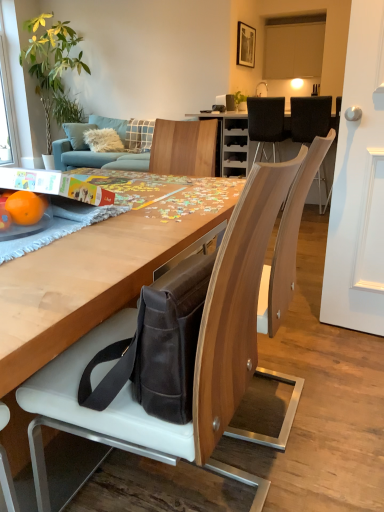
What do you see at coordinates (52, 68) in the screenshot? This screenshot has height=512, width=384. I see `green leafy plant at upper left` at bounding box center [52, 68].

What do you see at coordinates (6, 115) in the screenshot?
I see `transparent glass window screen at upper left` at bounding box center [6, 115].

The height and width of the screenshot is (512, 384). What do you see at coordinates (266, 122) in the screenshot?
I see `black leather chair at upper center, acting as the third chair starting from the front` at bounding box center [266, 122].

Identify the location of green leafy plant at upper left. This screenshot has height=512, width=384. (52, 68).

Is transparent glass window screen at upper left looking in the opposite direction of green leafy plant at upper left?

No, green leafy plant at upper left is not at the back of transparent glass window screen at upper left.

At what (x,y) coordinates should I click in order to perform the action: click on houseplant in front of the transparent glass window screen at upper left. Please return your answer as a coordinate pair (x, y). Looking at the image, I should click on (52, 68).

Consider the image. Is transparent glass window screen at upper left to the left of green leafy plant at upper left from the viewer's perspective?

Indeed, transparent glass window screen at upper left is positioned on the left side of green leafy plant at upper left.

From the image's perspective, between transparent glass window screen at upper left and green leafy plant at upper left, which one is located above?

green leafy plant at upper left.

From a real-world perspective, which object stands above the other?

In real-world perspective, orangesmoothfruit at left is above.

Between orangesmoothfruit at left and leather bag at lower center, marked as the 3th chair in a back-to-front arrangement, which one has larger size?

With larger size is leather bag at lower center, marked as the 3th chair in a back-to-front arrangement.

How different are the orientations of orangesmoothfruit at left and leather bag at lower center, marked as the 3th chair in a back-to-front arrangement, in degrees?

The angular difference between orangesmoothfruit at left and leather bag at lower center, marked as the 3th chair in a back-to-front arrangement, is 87.5 degrees.

Based on the photo, which point is more distant from viewer, (28, 201) or (271, 169)?

Positioned behind is point (28, 201).

Can you tell me how much leather bag at lower center, the first chair positioned from the front, and dark brown leather messenger bag at center differ in facing direction?

0.0012 degrees separate the facing orientations of leather bag at lower center, the first chair positioned from the front, and dark brown leather messenger bag at center.

Does leather bag at lower center, marked as the 3th chair in a back-to-front arrangement, appear on the right side of dark brown leather messenger bag at center?

Incorrect, leather bag at lower center, marked as the 3th chair in a back-to-front arrangement, is not on the right side of dark brown leather messenger bag at center.

Does leather bag at lower center, marked as the 3th chair in a back-to-front arrangement, come in front of dark brown leather messenger bag at center?

Yes.

From the picture: Who is taller, leather bag at lower center, acting as the third chair starting from the right, or dark brown leather messenger bag at center?

leather bag at lower center, acting as the third chair starting from the right, is taller.

From the picture: Looking at the image, does black leather chair at upper center, which is the second chair in left-to-right order, seem bigger or smaller compared to orangesmoothfruit at left?

black leather chair at upper center, which is the second chair in left-to-right order, is bigger than orangesmoothfruit at left.

From the image's perspective, who appears lower, black leather chair at upper center, the first chair positioned from the back, or orangesmoothfruit at left?

orangesmoothfruit at left.

Is orangesmoothfruit at left completely or partially inside black leather chair at upper center, which is counted as the third chair, starting from the bottom?

That's incorrect, orangesmoothfruit at left is not inside black leather chair at upper center, which is counted as the third chair, starting from the bottom.

How different are the orientations of leather bag at lower center, acting as the third chair starting from the top, and orangesmoothfruit at left in degrees?

The angular difference between leather bag at lower center, acting as the third chair starting from the top, and orangesmoothfruit at left is 87.5 degrees.

From a real-world perspective, is leather bag at lower center, the first chair positioned from the front, physically located above or below orangesmoothfruit at left?

leather bag at lower center, the first chair positioned from the front, is situated lower than orangesmoothfruit at left in the real world.

Is leather bag at lower center, which ranks as the 1th chair in bottom-to-top order, thinner than orangesmoothfruit at left?

No.

Based on their sizes in the image, would you say leather bag at lower center, marked as the 3th chair in a back-to-front arrangement, is bigger or smaller than orangesmoothfruit at left?

Clearly, leather bag at lower center, marked as the 3th chair in a back-to-front arrangement, is larger in size than orangesmoothfruit at left.

Consider the image. From a real-world perspective, is leather bag at lower center, which ranks as the 1th chair in bottom-to-top order, over black leather chair at upper center, which is the second chair in left-to-right order?

No, from a real-world perspective, leather bag at lower center, which ranks as the 1th chair in bottom-to-top order, is not over black leather chair at upper center, which is the second chair in left-to-right order

Between leather bag at lower center, the first chair positioned from the front, and black leather chair at upper center, which appears as the 2th chair when viewed from the right, which one has more height?

With more height is leather bag at lower center, the first chair positioned from the front.

Considering the positions of objects leather bag at lower center, marked as the 3th chair in a back-to-front arrangement, and black leather chair at upper center, the first chair positioned from the back, in the image provided, who is in front, leather bag at lower center, marked as the 3th chair in a back-to-front arrangement, or black leather chair at upper center, the first chair positioned from the back,?

leather bag at lower center, marked as the 3th chair in a back-to-front arrangement, is closer to the camera.

From the image's perspective, who appears lower, leather bag at lower center, acting as the third chair starting from the top, or black leather chair at upper center, which is the second chair in left-to-right order?

leather bag at lower center, acting as the third chair starting from the top, is shown below in the image.

Is black leather chair at upper right, arranged as the second chair when ordered from the bottom, touching green leafy plant at upper left?

No, black leather chair at upper right, arranged as the second chair when ordered from the bottom, is not with green leafy plant at upper left.

Considering the relative sizes of black leather chair at upper right, which ranks as the first chair in right-to-left order, and green leafy plant at upper left in the image provided, is black leather chair at upper right, which ranks as the first chair in right-to-left order, taller than green leafy plant at upper left?

Incorrect, the height of black leather chair at upper right, which ranks as the first chair in right-to-left order, is not larger of that of green leafy plant at upper left.

Does black leather chair at upper right, arranged as the second chair when ordered from the bottom, appear on the left side of green leafy plant at upper left?

In fact, black leather chair at upper right, arranged as the second chair when ordered from the bottom, is to the right of green leafy plant at upper left.

The image size is (384, 512). What are the coordinates of `houseplant above the transparent glass window screen at upper left (from the image's perspective)` in the screenshot? It's located at (52, 68).

The image size is (384, 512). What are the coordinates of `the 1st chair counting from the right side of the orangesmoothfruit at left` in the screenshot? It's located at (195, 361).

Looking at the image, which one is located further to black leather chair at upper center, which is the second chair in left-to-right order, orangesmoothfruit at left or dark brown leather messenger bag at center?

dark brown leather messenger bag at center lies further to black leather chair at upper center, which is the second chair in left-to-right order, than the other object.

Which object lies nearer to the anchor point green leafy plant at upper left, leather bag at lower center, acting as the third chair starting from the top, or transparent glass window screen at upper left?

The object closer to green leafy plant at upper left is transparent glass window screen at upper left.

Which object lies nearer to the anchor point transparent glass window screen at upper left, green leafy plant at upper left or dark brown leather messenger bag at center?

Based on the image, green leafy plant at upper left appears to be nearer to transparent glass window screen at upper left.

From the image, which object appears to be farther from dark brown leather messenger bag at center, black leather chair at upper right, marked as the 2th chair in a top-to-bottom arrangement, or orangesmoothfruit at left?

The object further to dark brown leather messenger bag at center is black leather chair at upper right, marked as the 2th chair in a top-to-bottom arrangement.

When comparing their distances from dark brown leather messenger bag at center, does transparent glass window screen at upper left or black leather chair at upper center, the first chair positioned from the back, seem further?

transparent glass window screen at upper left is positioned further to the anchor dark brown leather messenger bag at center.

Considering their positions, is black leather chair at upper right, arranged as the second chair when ordered from the bottom, positioned closer to transparent glass window screen at upper left than black leather chair at upper center, the first chair positioned from the back?

black leather chair at upper center, the first chair positioned from the back, is positioned closer to the anchor transparent glass window screen at upper left.

Estimate the real-world distances between objects in this image. Which object is further from leather bag at lower center, the first chair positioned from the front, black leather chair at upper center, the first chair positioned from the back, or green leafy plant at upper left?

The object further to leather bag at lower center, the first chair positioned from the front, is green leafy plant at upper left.

Considering their positions, is transparent glass window screen at upper left positioned closer to black leather chair at upper right, which ranks as the first chair in right-to-left order, than black leather chair at upper center, which is the second chair in left-to-right order?

Among the two, black leather chair at upper center, which is the second chair in left-to-right order, is located nearer to black leather chair at upper right, which ranks as the first chair in right-to-left order.

Identify the location of messenger bag located between leather bag at lower center, marked as the 3th chair in a back-to-front arrangement, and black leather chair at upper right, marked as the 2th chair in a top-to-bottom arrangement, in the depth direction. This screenshot has width=384, height=512. (158, 346).

The image size is (384, 512). Identify the location of houseplant located between dark brown leather messenger bag at center and transparent glass window screen at upper left in the depth direction. pos(52,68).

You are a GUI agent. You are given a task and a screenshot of the screen. Output one action in this format:
    pyautogui.click(x=<x>, y=<y>)
    Task: Click on the orange located between leather bag at lower center, the first chair positioned from the front, and black leather chair at upper center, which appears as the 2th chair when viewed from the right, in the depth direction
    The width and height of the screenshot is (384, 512).
    Given the screenshot: What is the action you would take?
    pyautogui.click(x=26, y=207)

Where is `orange between leather bag at lower center, the first chair positioned from the front, and transparent glass window screen at upper left, along the z-axis`? orange between leather bag at lower center, the first chair positioned from the front, and transparent glass window screen at upper left, along the z-axis is located at coordinates (26, 207).